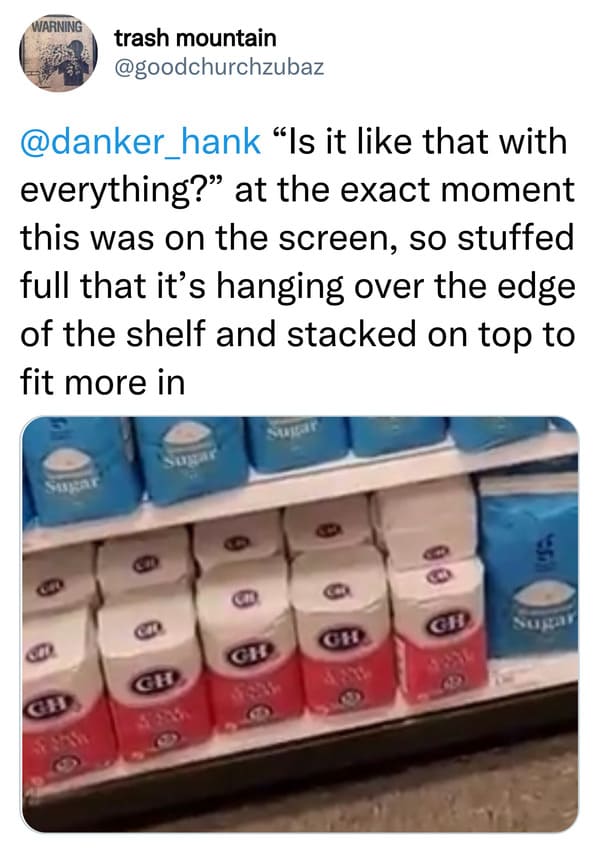
Locate an element on the screen. The image size is (599, 855). this blue bag of sugar is on bottom shelf and seems larger than the blue ones above is located at coordinates (530, 586).